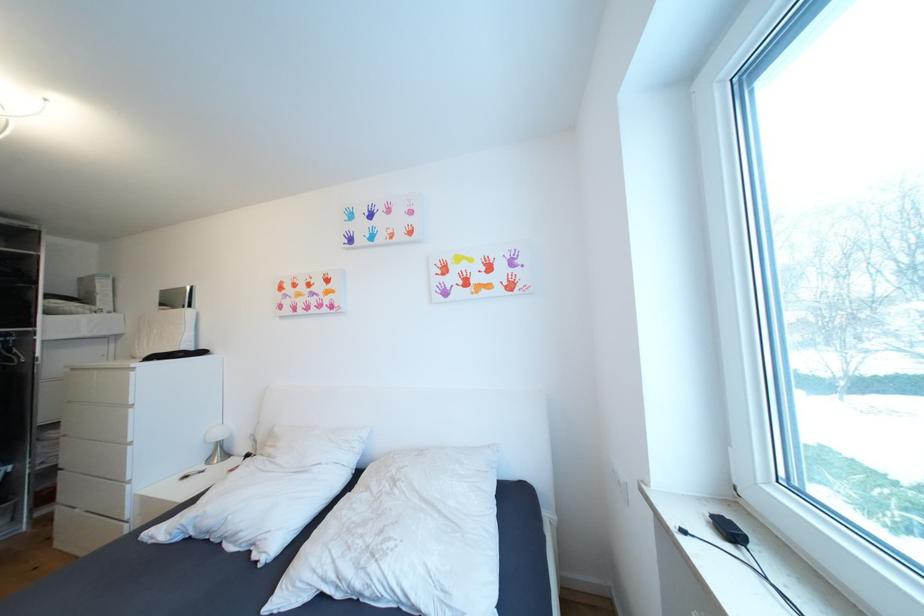
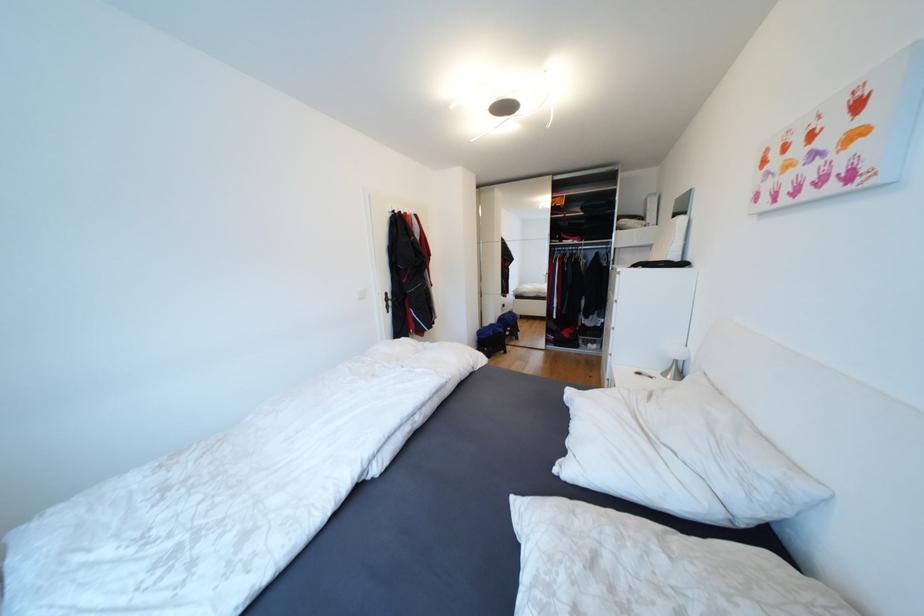
Question: Based on the continuous images, in which direction is the camera rotating? Reply with the corresponding letter.

Choices:
 (A) Left
 (B) Right
 (C) Up
 (D) Down

Answer: (A)